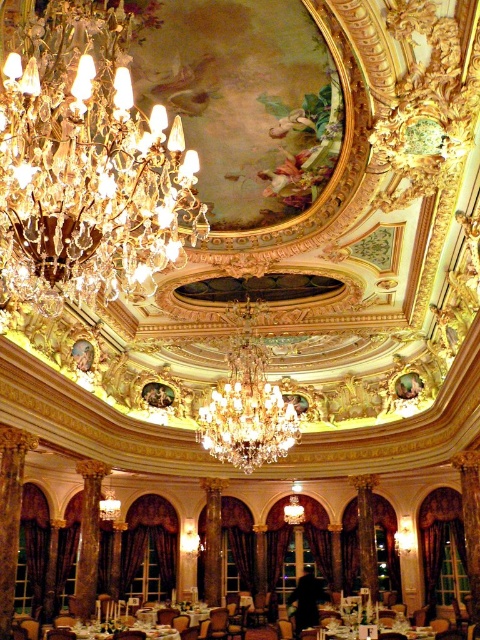
You are planning to host a formal dinner and need to seat guests around the white glossy table at lower center and the white glossy table at center. Based on the scene description, which table would accommodate more guests comfortably?

The white glossy table at lower center might be wider than the white glossy table at center, so it could accommodate more guests comfortably.

In the scene shown: You are standing in the grand dining hall and want to place a centerpiece on the white glossy table at lower center. To ensure it doesn not block the view of the crystal glass chandelier at upper left, which direction should you place the centerpiece relative to the table?

The crystal glass chandelier at upper left is to the right of the white glossy table at lower center. Therefore, placing the centerpiece on the left side of the white glossy table at lower center will keep it from blocking the view of the chandelier.

You are planning to set up a long tablecloth that is 15 feet long for a special event in this grand dining hall. You see two white glossy tables in the scene. Can the tablecloth stretch from the white glossy table at lower center to the white glossy table at center without needing to be folded or cut?

The distance between the white glossy table at lower center and the white glossy table at center is 14.72 feet. Since the tablecloth is 15 feet long, it can easily stretch between them without needing to be folded or cut, as it is slightly longer than the required distance.